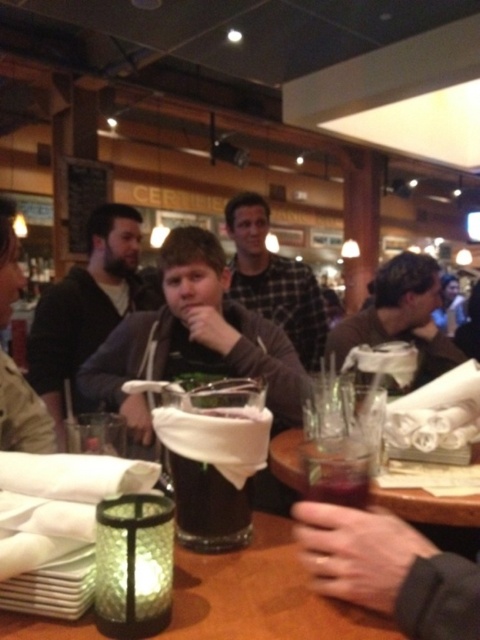
Does plaid flannel shirt at center come in front of matte brown shirt at center?

No.

Does plaid flannel shirt at center appear on the left side of matte brown shirt at center?

Indeed, plaid flannel shirt at center is positioned on the left side of matte brown shirt at center.

Does point (238, 221) lie in front of point (421, 298)?

That is False.

The height and width of the screenshot is (640, 480). I want to click on plaid flannel shirt at center, so click(274, 280).

Measure the distance from plaid flannel shirt at center to matte black jacket at center.

plaid flannel shirt at center is 4.04 feet from matte black jacket at center.

Which of these two, plaid flannel shirt at center or matte black jacket at center, stands taller?

With more height is plaid flannel shirt at center.

The height and width of the screenshot is (640, 480). I want to click on plaid flannel shirt at center, so click(x=274, y=280).

Who is more distant from viewer, (122,244) or (443,348)?

The point (122,244) is more distant.

Who is shorter, dark gray sweater at center or matte brown shirt at center?

matte brown shirt at center

Is point (85, 336) positioned after point (369, 337)?

Yes, point (85, 336) is behind point (369, 337).

Image resolution: width=480 pixels, height=640 pixels. I want to click on dark gray sweater at center, so click(87, 307).